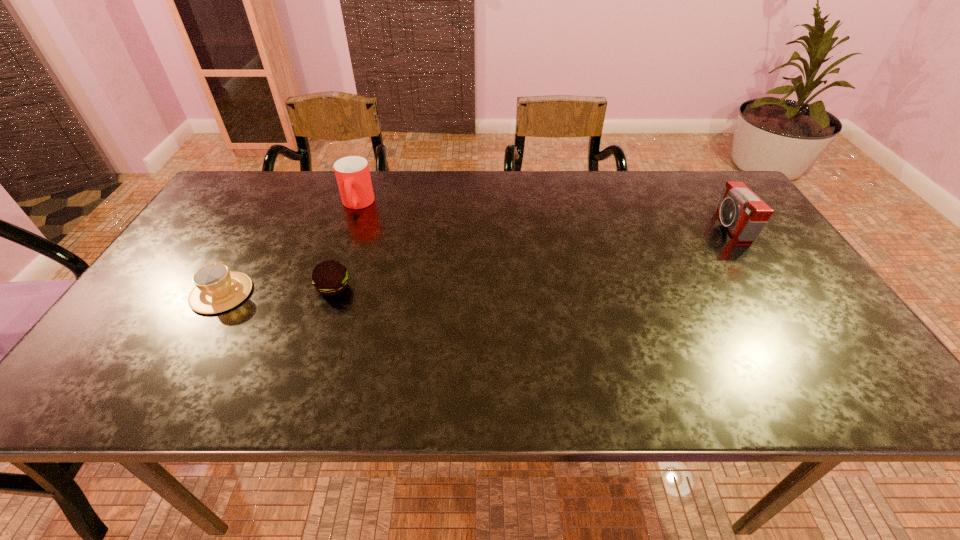
Image resolution: width=960 pixels, height=540 pixels. What are the coordinates of `vacant point at the near edge` in the screenshot? It's located at (287, 383).

Where is `free space at the right edge of the desktop`? free space at the right edge of the desktop is located at coordinates tap(805, 345).

You are a GUI agent. You are given a task and a screenshot of the screen. Output one action in this format:
    pyautogui.click(x=<x>, y=<y>)
    Task: Click on the vacant region at the near left corner of the desktop
    
    Given the screenshot: What is the action you would take?
    pyautogui.click(x=151, y=388)

What are the coordinates of `free spot between the taller cup and the nearer cup` in the screenshot? It's located at (290, 249).

Locate an element on the screen. The height and width of the screenshot is (540, 960). free spot between the farther cup and the shorter cup is located at coordinates (290, 249).

This screenshot has width=960, height=540. I want to click on vacant space that's between the shorter cup and the taller cup, so click(290, 249).

Identify the location of vacant area that lies between the rightmost object and the patty. (532, 257).

Locate an element on the screen. The height and width of the screenshot is (540, 960). free space that is in between the left cup and the rightmost object is located at coordinates (476, 260).

Identify the location of unoccupied position between the rightmost object and the leftmost object. The height and width of the screenshot is (540, 960). (476, 260).

Where is `free area in between the farther cup and the patty`? This screenshot has height=540, width=960. free area in between the farther cup and the patty is located at coordinates (346, 246).